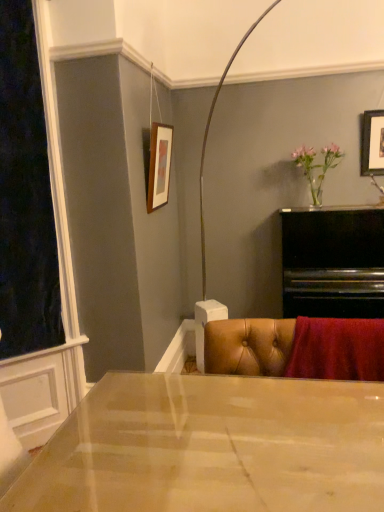
Question: Does matte wooden picture frame at upper center, the first picture frame from the left, come in front of wooden picture frame at upper right, positioned as the 1th picture frame in right-to-left order?

Choices:
 (A) no
 (B) yes

Answer: (B)

Question: Is wooden picture frame at upper right, positioned as the 1th picture frame in right-to-left order, inside matte wooden picture frame at upper center, the first picture frame from the left?

Choices:
 (A) yes
 (B) no

Answer: (B)

Question: From a real-world perspective, is matte wooden picture frame at upper center, the second picture frame in the right-to-left sequence, beneath wooden picture frame at upper right, which ranks as the second picture frame in left-to-right order?

Choices:
 (A) yes
 (B) no

Answer: (A)

Question: Could you tell me if matte wooden picture frame at upper center, the first picture frame from the left, is turned towards wooden picture frame at upper right, which ranks as the second picture frame in left-to-right order?

Choices:
 (A) no
 (B) yes

Answer: (B)

Question: Is matte wooden picture frame at upper center, the first picture frame from the left, taller than wooden picture frame at upper right, which ranks as the second picture frame in left-to-right order?

Choices:
 (A) no
 (B) yes

Answer: (B)

Question: From a real-world perspective, is wooden picture frame at upper right, which ranks as the second picture frame in left-to-right order, above or below matte wooden picture frame at upper center, the second picture frame in the right-to-left sequence?

Choices:
 (A) below
 (B) above

Answer: (B)

Question: Looking at the image, does wooden picture frame at upper right, positioned as the 1th picture frame in right-to-left order, seem bigger or smaller compared to matte wooden picture frame at upper center, the second picture frame in the right-to-left sequence?

Choices:
 (A) small
 (B) big

Answer: (A)

Question: Is point 362,132 positioned closer to the camera than point 155,192?

Choices:
 (A) farther
 (B) closer

Answer: (A)

Question: From the image's perspective, is wooden picture frame at upper right, positioned as the 1th picture frame in right-to-left order, above or below matte wooden picture frame at upper center, the first picture frame from the left?

Choices:
 (A) above
 (B) below

Answer: (A)

Question: Considering the positions of point (13, 283) and point (162, 167), is point (13, 283) closer or farther from the camera than point (162, 167)?

Choices:
 (A) closer
 (B) farther

Answer: (A)

Question: Based on their sizes in the image, would you say velvet dark at left is bigger or smaller than matte wooden picture frame at upper center, the second picture frame in the right-to-left sequence?

Choices:
 (A) small
 (B) big

Answer: (B)

Question: Is velvet dark at left wider or thinner than matte wooden picture frame at upper center, the second picture frame in the right-to-left sequence?

Choices:
 (A) thin
 (B) wide

Answer: (B)

Question: From a real-world perspective, relative to matte wooden picture frame at upper center, the second picture frame in the right-to-left sequence, is velvet dark at left vertically above or below?

Choices:
 (A) below
 (B) above

Answer: (A)

Question: In the image, is wooden picture frame at upper right, positioned as the 1th picture frame in right-to-left order, positioned in front of or behind velvet dark at left?

Choices:
 (A) front
 (B) behind

Answer: (B)

Question: Considering the positions of wooden picture frame at upper right, which ranks as the second picture frame in left-to-right order, and velvet dark at left in the image, is wooden picture frame at upper right, which ranks as the second picture frame in left-to-right order, bigger or smaller than velvet dark at left?

Choices:
 (A) big
 (B) small

Answer: (B)